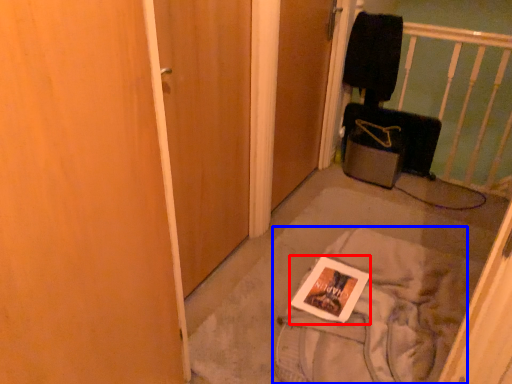
Question: Which object appears farthest to the camera in this image, magazine (highlighted by a red box) or material (highlighted by a blue box)?

Choices:
 (A) magazine
 (B) material

Answer: (A)